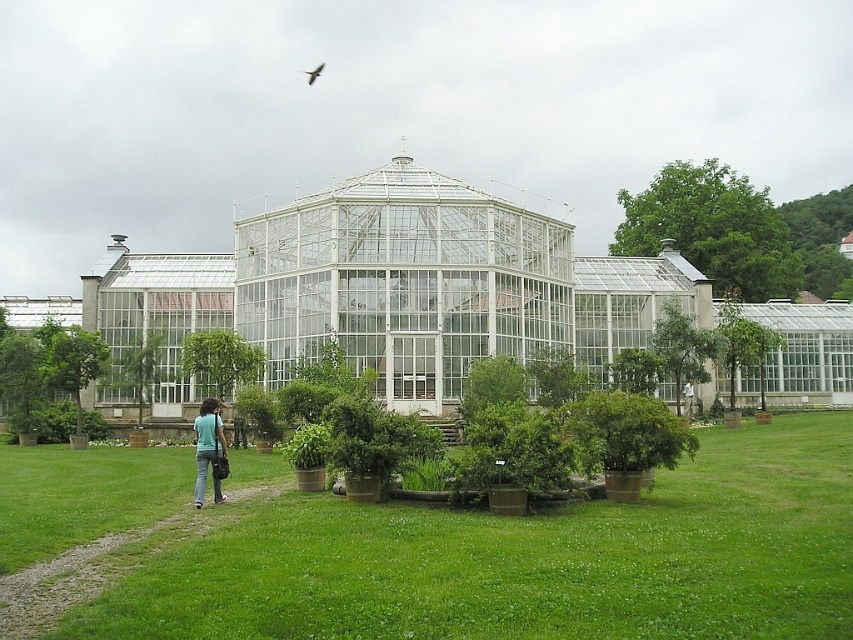
You are standing in the greenhouse and want to place a new potted plant exactly at the center of the greenhouse. The current green matte potted plants at center are already placed. Can you determine if the new plant will be placed in the same location as the existing ones?

The green matte potted plants at center are already located at point 2D coordinates of (527, 560). Therefore, placing the new plant at the center would mean it would be in the same location as the existing ones.

You are a gardener who wants to place a new statue that is 1.2 meters tall in the greenhouse area. Considering the height of the green matte potted plants at center and the black feathered bird at upper center, which object is shorter and thus safer to place the statue next to without blocking the view?

The green matte potted plants at center are shorter than the black feathered bird at upper center. Therefore, placing the statue next to the green matte potted plants at center would be safer to avoid blocking the view.